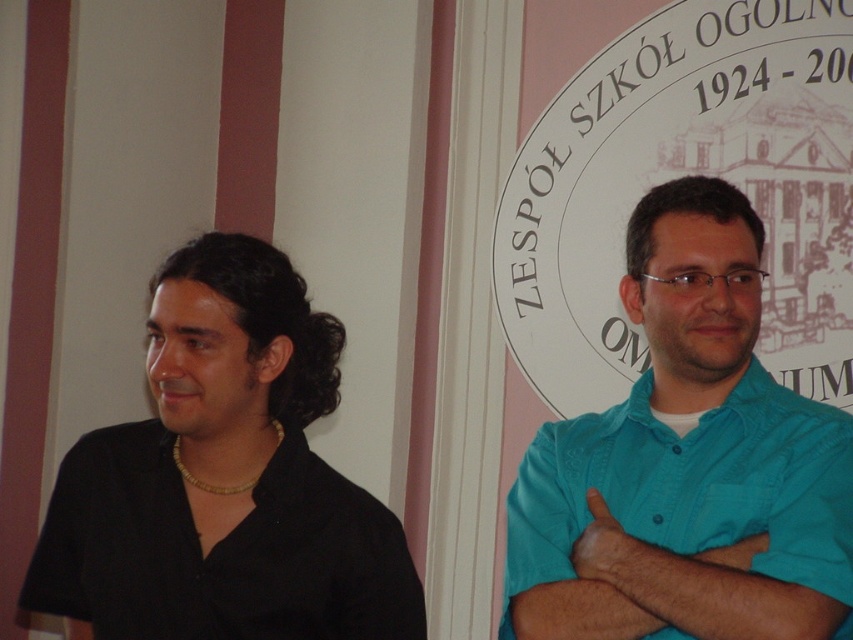
Is point (636, 321) farther from camera compared to point (233, 365)?

Yes, it is.

Who is more forward, (x=596, y=417) or (x=44, y=595)?

Point (x=44, y=595)

Find the location of `teal cotton shirt at right`. teal cotton shirt at right is located at coordinates (688, 464).